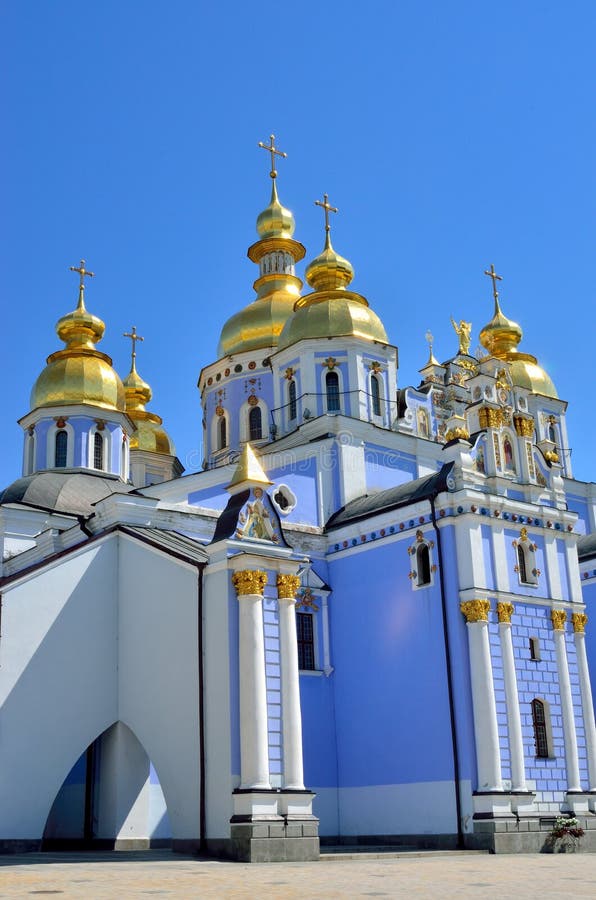
Find the location of `columns`. columns is located at coordinates (586, 685), (569, 703), (516, 748), (492, 740), (293, 736), (259, 724).